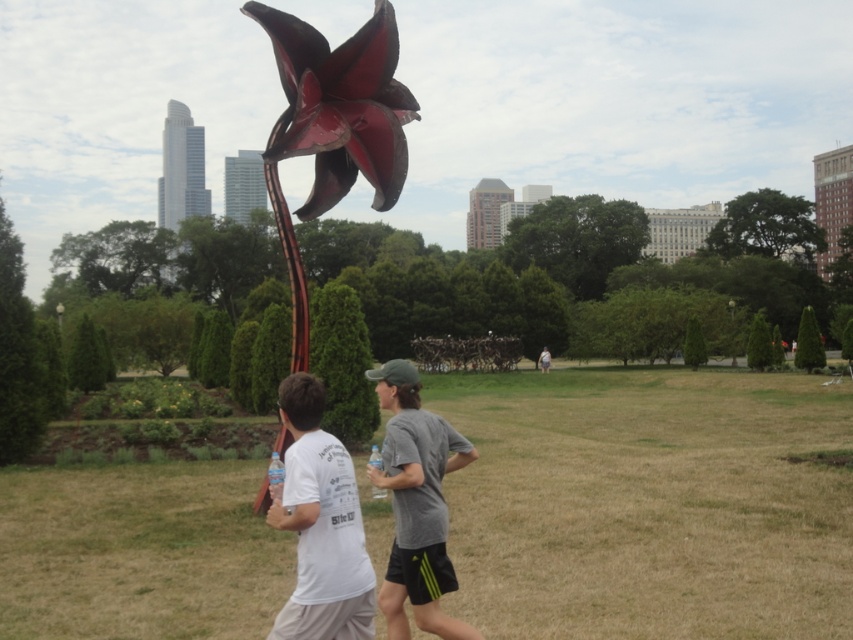
Is white matte t-shirt at center shorter than gray fabric shirt at center?

Yes, white matte t-shirt at center is shorter than gray fabric shirt at center.

Which is below, white matte t-shirt at center or gray fabric shirt at center?

gray fabric shirt at center is lower down.

Between point (361, 605) and point (439, 422), which one is positioned in front?

Point (361, 605) is more forward.

The width and height of the screenshot is (853, 640). I want to click on white matte t-shirt at center, so click(320, 525).